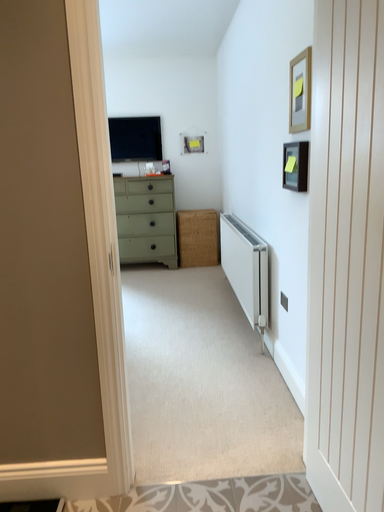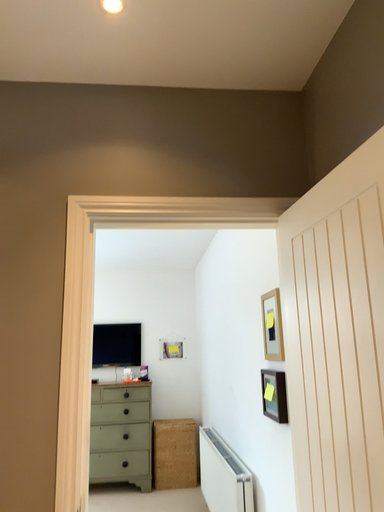
Question: How did the camera likely rotate when shooting the video?

Choices:
 (A) rotated left
 (B) rotated right

Answer: (A)